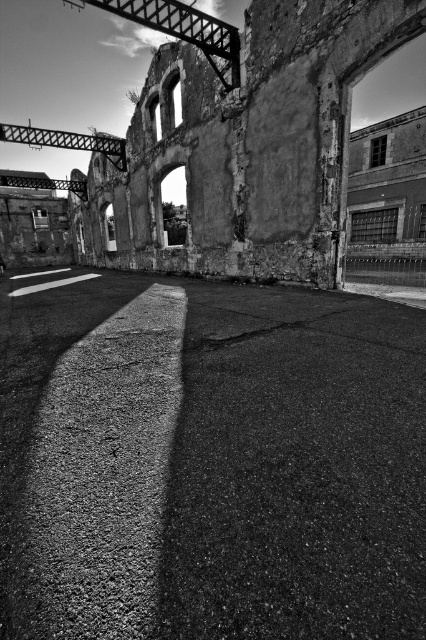
Question: Can you confirm if asphalt at center is smaller than rough concrete ruins at center?

Choices:
 (A) yes
 (B) no

Answer: (A)

Question: Is asphalt at center below rough concrete ruins at center?

Choices:
 (A) yes
 (B) no

Answer: (A)

Question: Is asphalt at center to the left of rough concrete ruins at center from the viewer's perspective?

Choices:
 (A) yes
 (B) no

Answer: (B)

Question: Which object appears farthest from the camera in this image?

Choices:
 (A) asphalt at center
 (B) rough concrete ruins at center

Answer: (B)